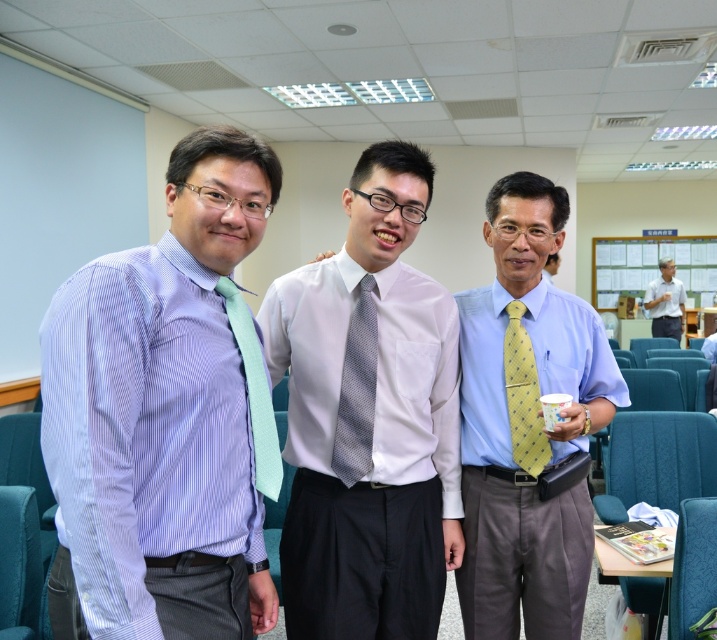
Looking at this image, you are organizing a formal event and need to ensure that all attire accessories are appropriately sized. Given the description of the matte blue shirt at left and the matte green tie at left, which item would you recommend adjusting if you want to maintain a balanced appearance?

The matte blue shirt at left is larger than the matte green tie at left. To achieve a balanced appearance, you could consider adjusting the size of the matte blue shirt at left by selecting a smaller size or altering its fit to better complement the smaller matte green tie at left.

Based on the scene description, which object is taller between the yellow dotted tie at center and the light blue shirt at center?

The yellow dotted tie at center is taller than the light blue shirt at center according to the description.

You are a photographer setting up for a group photo in an office. You notice two items on the man in the center of the image. What is the position of the yellow dotted tie at center relative to the light blue shirt at center?

The yellow dotted tie at center is below the light blue shirt at center.